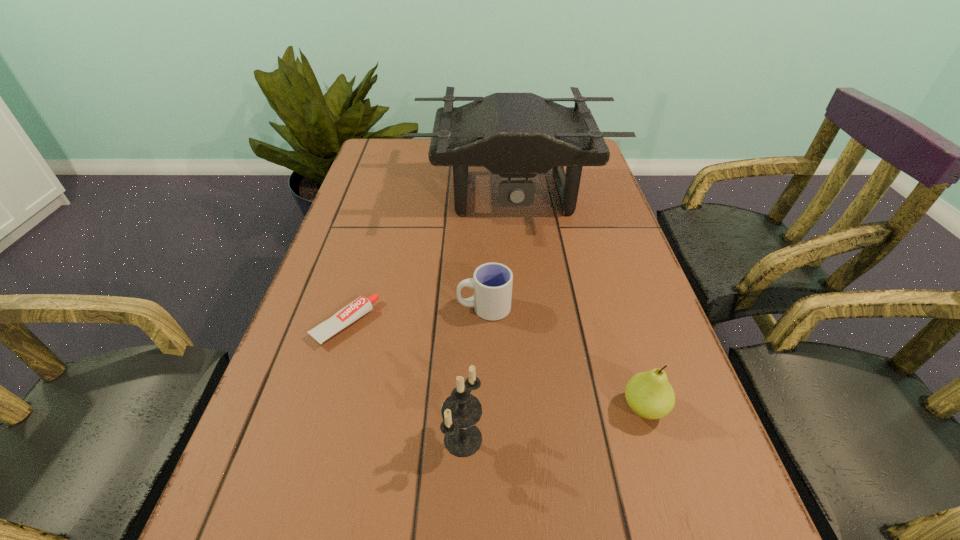
Where is `vacant space located 0.290m with the handle on the side of the fourth tallest object`? The width and height of the screenshot is (960, 540). vacant space located 0.290m with the handle on the side of the fourth tallest object is located at coordinates (319, 308).

Find the location of `vacant space situated 0.060m with the handle on the side of the fourth tallest object`. vacant space situated 0.060m with the handle on the side of the fourth tallest object is located at coordinates (429, 308).

The image size is (960, 540). What are the coordinates of `free region located with the handle on the side of the fourth tallest object` in the screenshot? It's located at (362, 308).

Locate an element on the screen. Image resolution: width=960 pixels, height=540 pixels. free space located on the right of the leftmost object is located at coordinates (435, 323).

Where is `object that is positioned at the far edge`? This screenshot has width=960, height=540. object that is positioned at the far edge is located at coordinates (516, 135).

Image resolution: width=960 pixels, height=540 pixels. I want to click on object present at the left edge, so click(x=362, y=305).

Locate an element on the screen. Image resolution: width=960 pixels, height=540 pixels. drone that is at the right edge is located at coordinates (516, 135).

Identify the location of pear that is positioned at the right edge. (649, 394).

Where is `object that is at the far right corner`? The image size is (960, 540). object that is at the far right corner is located at coordinates (516, 135).

This screenshot has width=960, height=540. I want to click on free spot at the left edge of the desktop, so click(249, 469).